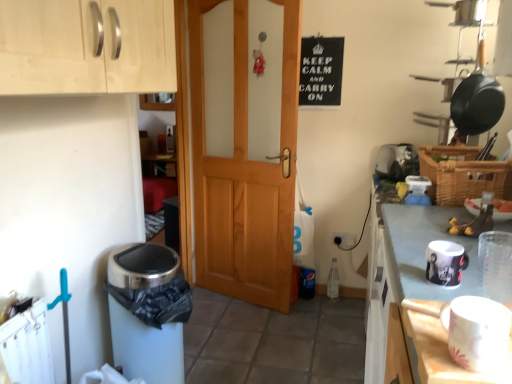
The height and width of the screenshot is (384, 512). Identify the location of wooden door at center. (244, 145).

I want to click on matte black mug at right, marked as the 1th appliance in a bottom-to-top arrangement, so click(x=444, y=263).

What is the approximate height of black matte sign at upper center?

The height of black matte sign at upper center is 16.61 inches.

Describe the element at coordinates (445, 353) in the screenshot. I see `white matte table at lower right` at that location.

This screenshot has width=512, height=384. I want to click on white glossy mug at upper right, so click(421, 253).

What do you see at coordinates (463, 174) in the screenshot? Image resolution: width=512 pixels, height=384 pixels. I see `woven brown basket at right` at bounding box center [463, 174].

At what (x,y) coordinates should I click in order to perform the action: click on wooden door at center. Please return your answer as a coordinate pair (x, y). Looking at the image, I should click on (244, 145).

From the picture: Measure the distance from white matte table at lower right to light wood cabinet at upper left.

The distance of white matte table at lower right from light wood cabinet at upper left is 3.43 feet.

What's the angular difference between white matte table at lower right and light wood cabinet at upper left's facing directions?

The angular difference between white matte table at lower right and light wood cabinet at upper left is 177 degrees.

Based on the photo, is the depth of white matte table at lower right less than that of light wood cabinet at upper left?

Yes, the depth of white matte table at lower right is less than that of light wood cabinet at upper left.

Considering the relative sizes of white matte table at lower right and light wood cabinet at upper left in the image provided, is white matte table at lower right shorter than light wood cabinet at upper left?

Yes.

How distant is white glossy mug at upper right from white matte table at lower right?

The distance of white glossy mug at upper right from white matte table at lower right is 13.63 inches.

Does white glossy mug at upper right have a lesser width compared to white matte table at lower right?

No, white glossy mug at upper right is not thinner than white matte table at lower right.

Is white glossy mug at upper right smaller than white matte table at lower right?

No, white glossy mug at upper right is not smaller than white matte table at lower right.

From the image's perspective, is white glossy mug at upper right on top of white matte table at lower right?

No, from the image's perspective, white glossy mug at upper right is not over white matte table at lower right.

From a real-world perspective, is white matte table at lower right below woven brown basket at right?

Yes, from a real-world perspective, white matte table at lower right is beneath woven brown basket at right.

Can you confirm if white matte table at lower right is thinner than woven brown basket at right?

Correct, the width of white matte table at lower right is less than that of woven brown basket at right.

Where is `table that appears on the left of woven brown basket at right`? The width and height of the screenshot is (512, 384). table that appears on the left of woven brown basket at right is located at coordinates (445, 353).

Is white matte table at lower right taller than woven brown basket at right?

No, white matte table at lower right is not taller than woven brown basket at right.

Which is in front, point (56, 48) or point (417, 159)?

The point (56, 48) is in front.

Who is bigger, light wood cabinet at upper left or white plastic toaster at upper right, positioned as the first appliance in right-to-left order?

light wood cabinet at upper left.

Is the position of light wood cabinet at upper left less distant than that of white plastic toaster at upper right, positioned as the first appliance in right-to-left order?

Yes, light wood cabinet at upper left is in front of white plastic toaster at upper right, positioned as the first appliance in right-to-left order.

How many degrees apart are the facing directions of light wood cabinet at upper left and white plastic toaster at upper right, placed as the first appliance when sorted from top to bottom?

64.4 degrees.

Which object is positioned more to the left, woven brown basket at right or white plastic toaster at upper right, positioned as the first appliance in right-to-left order?

Positioned to the left is white plastic toaster at upper right, positioned as the first appliance in right-to-left order.

From a real-world perspective, relative to white plastic toaster at upper right, positioned as the 2th appliance in front-to-back order, is woven brown basket at right vertically above or below?

Clearly, from a real-world perspective, woven brown basket at right is above white plastic toaster at upper right, positioned as the 2th appliance in front-to-back order.

Is woven brown basket at right wider or thinner than white plastic toaster at upper right, positioned as the 2th appliance in front-to-back order?

Considering their sizes, woven brown basket at right looks broader than white plastic toaster at upper right, positioned as the 2th appliance in front-to-back order.

Can you confirm if woven brown basket at right is shorter than white plastic toaster at upper right, the 2th appliance in the left-to-right sequence?

Indeed, woven brown basket at right has a lesser height compared to white plastic toaster at upper right, the 2th appliance in the left-to-right sequence.

From a real-world perspective, is woven brown basket at right physically above light wood cabinet at upper left?

No, from a real-world perspective, woven brown basket at right is not over light wood cabinet at upper left

Are woven brown basket at right and light wood cabinet at upper left beside each other?

There is a gap between woven brown basket at right and light wood cabinet at upper left.

From the white matte table at lower right, count 2nd appliance to the right and point to it. Please provide its 2D coordinates.

[(396, 161)]

Considering the sizes of white matte table at lower right and white plastic toaster at upper right, which is the second appliance from bottom to top, in the image, is white matte table at lower right taller or shorter than white plastic toaster at upper right, which is the second appliance from bottom to top,?

Clearly, white matte table at lower right is shorter compared to white plastic toaster at upper right, which is the second appliance from bottom to top.

Considering the relative sizes of white matte table at lower right and white plastic toaster at upper right, which is the second appliance from bottom to top, in the image provided, is white matte table at lower right smaller than white plastic toaster at upper right, which is the second appliance from bottom to top,?

Correct, white matte table at lower right occupies less space than white plastic toaster at upper right, which is the second appliance from bottom to top.

From a real-world perspective, is white matte table at lower right below white plastic toaster at upper right, which is the second appliance from bottom to top?

Yes, from a real-world perspective, white matte table at lower right is under white plastic toaster at upper right, which is the second appliance from bottom to top.

Image resolution: width=512 pixels, height=384 pixels. Find the location of `cabinetry on the left of white matte table at lower right`. cabinetry on the left of white matte table at lower right is located at coordinates (86, 47).

Identify the location of table in front of the white glossy mug at upper right. (445, 353).

Considering their positions, is white matte table at lower right positioned closer to white glossy mug at upper right than light wood cabinet at upper left?

white matte table at lower right is closer to white glossy mug at upper right.

Estimate the real-world distances between objects in this image. Which object is closer to matte black mug at right, marked as the 1th appliance in a bottom-to-top arrangement, black matte sign at upper center or woven brown basket at right?

woven brown basket at right is positioned closer to the anchor matte black mug at right, marked as the 1th appliance in a bottom-to-top arrangement.

Estimate the real-world distances between objects in this image. Which object is closer to white glossy mug at upper right, matte black mug at right, which ranks as the 2th appliance in back-to-front order, or woven brown basket at right?

Among the two, matte black mug at right, which ranks as the 2th appliance in back-to-front order, is located nearer to white glossy mug at upper right.

From the image, which object appears to be farther from matte black mug at right, acting as the first appliance starting from the front, white plastic toaster at upper right, positioned as the 2th appliance in front-to-back order, or white glossy mug at upper right?

white plastic toaster at upper right, positioned as the 2th appliance in front-to-back order, is further to matte black mug at right, acting as the first appliance starting from the front.

Estimate the real-world distances between objects in this image. Which object is closer to black matte sign at upper center, woven brown basket at right or white plastic toaster at upper right, the 2th appliance in the left-to-right sequence?

Among the two, white plastic toaster at upper right, the 2th appliance in the left-to-right sequence, is located nearer to black matte sign at upper center.

Based on their spatial positions, is white plastic toaster at upper right, the 2th appliance in the left-to-right sequence, or white glossy mug at upper right further from black matte sign at upper center?

Among the two, white glossy mug at upper right is located further to black matte sign at upper center.

Estimate the real-world distances between objects in this image. Which object is closer to matte black mug at right, acting as the first appliance starting from the front, white matte table at lower right or woven brown basket at right?

white matte table at lower right is positioned closer to the anchor matte black mug at right, acting as the first appliance starting from the front.

Based on their spatial positions, is matte black mug at right, marked as the 1th appliance in a bottom-to-top arrangement, or light wood cabinet at upper left further from white glossy mug at upper right?

light wood cabinet at upper left is positioned further to the anchor white glossy mug at upper right.

Locate an element on the screen. door between white glossy mug at upper right and white plastic toaster at upper right, positioned as the first appliance in right-to-left order, in the front-back direction is located at coordinates (244, 145).

Locate an element on the screen. Image resolution: width=512 pixels, height=384 pixels. countertop located between white matte table at lower right and wooden door at center in the depth direction is located at coordinates [421, 253].

At what (x,y) coordinates should I click in order to perform the action: click on table between light wood cabinet at upper left and white glossy mug at upper right. Please return your answer as a coordinate pair (x, y). Image resolution: width=512 pixels, height=384 pixels. Looking at the image, I should click on (445, 353).

Find the location of a particular element. The height and width of the screenshot is (384, 512). countertop between light wood cabinet at upper left and black matte sign at upper center in the front-back direction is located at coordinates (421, 253).